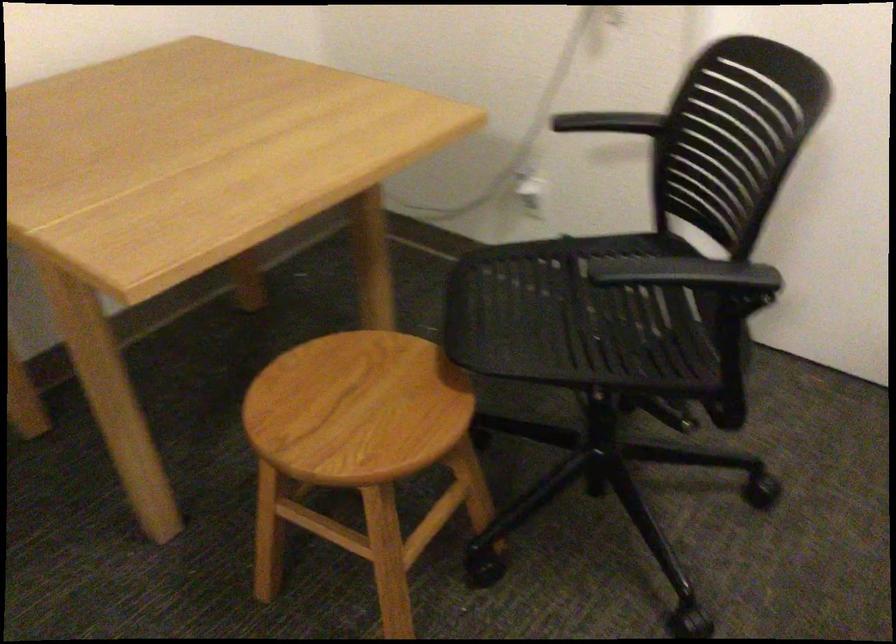
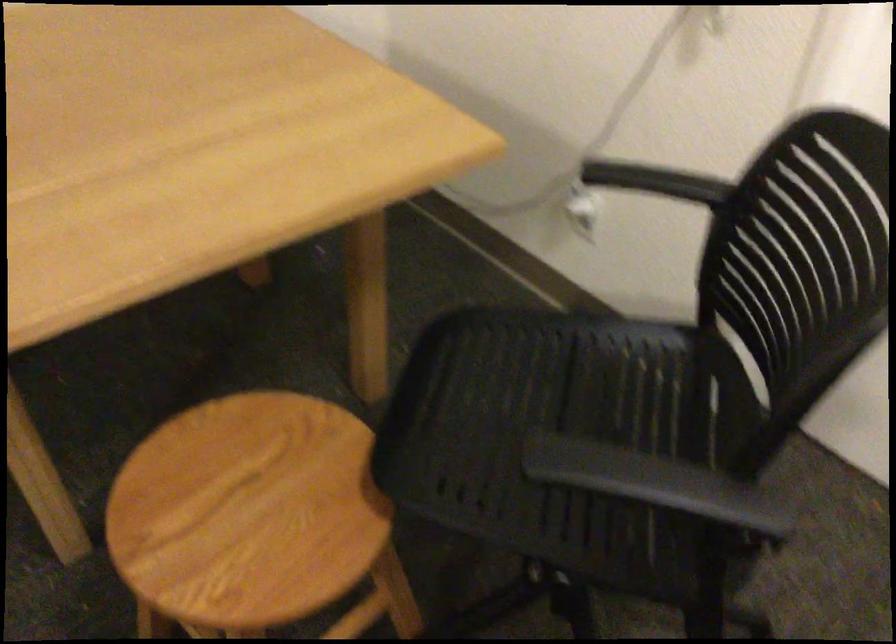
Question: Based on the continuous images, in which direction is the camera rotating? Reply with the corresponding letter.

Choices:
 (A) Left
 (B) Right
 (C) Up
 (D) Down

Answer: (D)